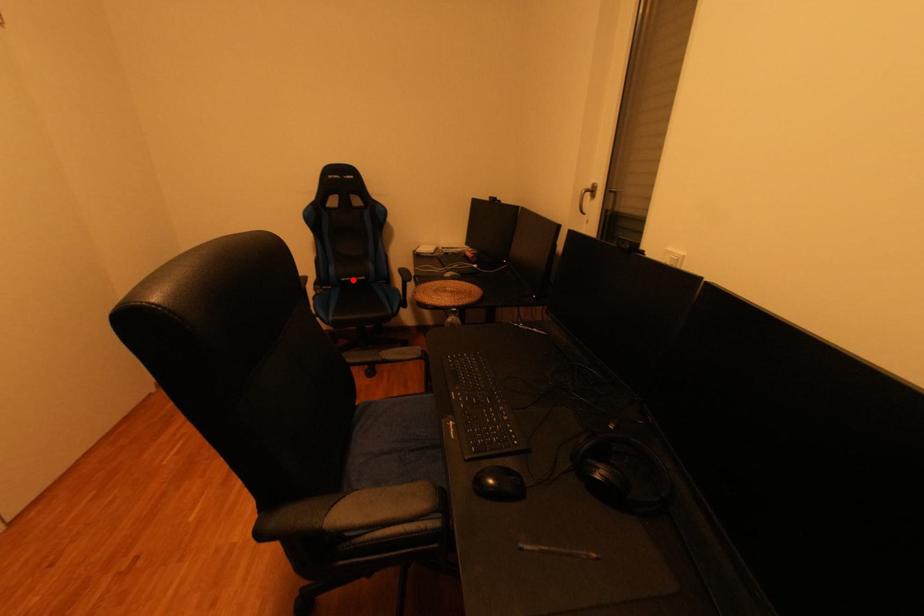
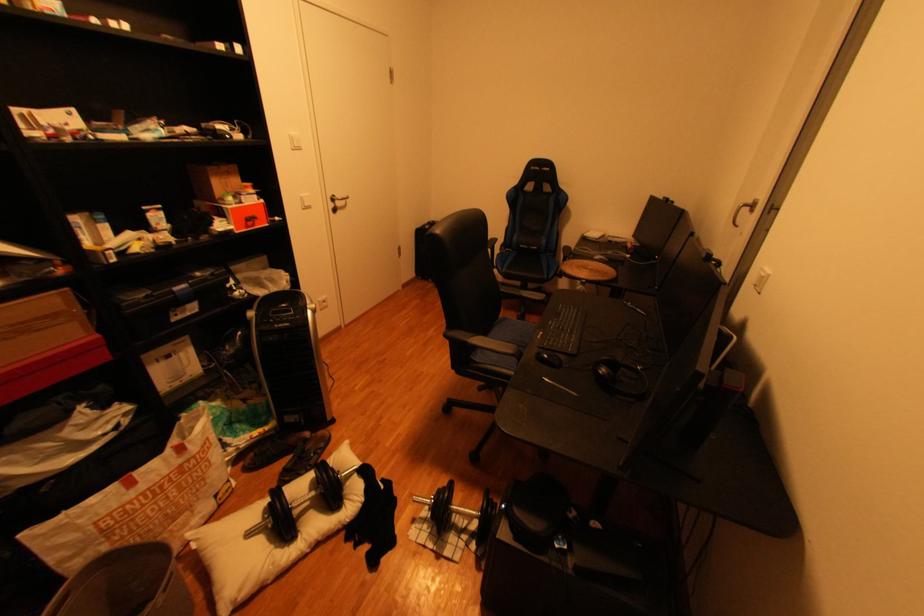
The point at the highlighted location is marked in the first image. Where is the corresponding point in the second image?

(531, 246)